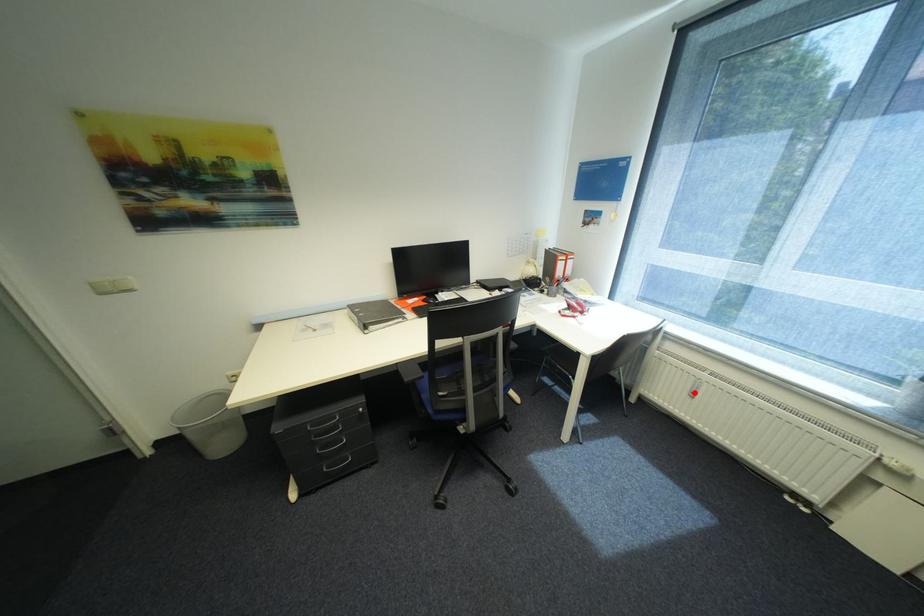
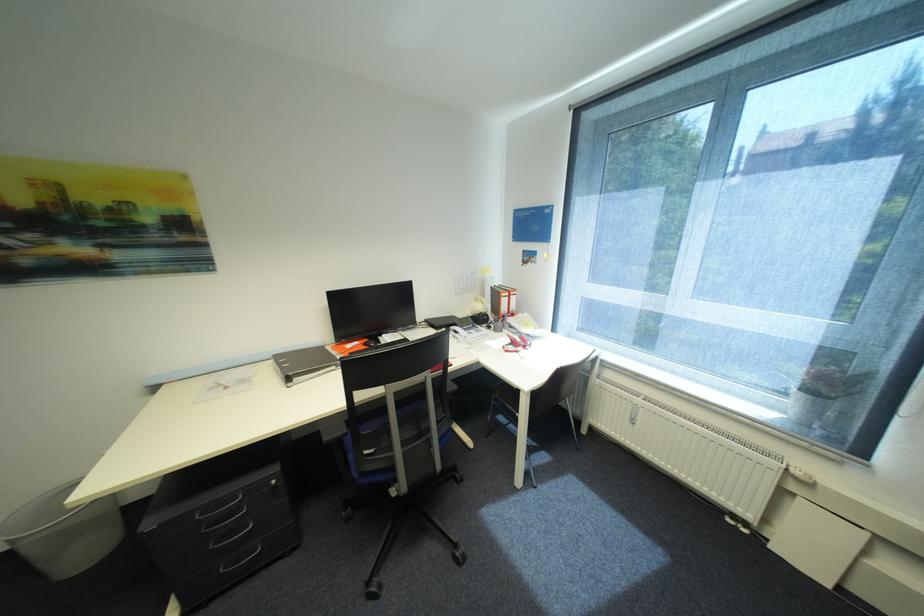
Question: I am providing you with two images of the same scene from different viewpoints. Given a red point in image1, look at the same physical point in image2. Is it:

Choices:
 (A) Closer to the viewpoint
 (B) Farther from the viewpoint

Answer: (B)